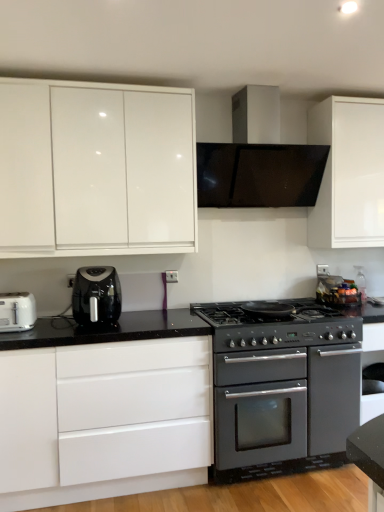
Question: Considering the positions of white glossy cabinet at lower left, positioned as the second cabinetry in top-to-bottom order, and glossy white cabinet at upper left, positioned as the 2th cabinetry in bottom-to-top order, in the image, is white glossy cabinet at lower left, positioned as the second cabinetry in top-to-bottom order, bigger or smaller than glossy white cabinet at upper left, positioned as the 2th cabinetry in bottom-to-top order,?

Choices:
 (A) small
 (B) big

Answer: (B)

Question: From a real-world perspective, relative to glossy white cabinet at upper left, positioned as the 2th cabinetry in bottom-to-top order, is white glossy cabinet at lower left, positioned as the second cabinetry in top-to-bottom order, vertically above or below?

Choices:
 (A) above
 (B) below

Answer: (B)

Question: Based on their relative distances, which object is farther from the matte black oven at center?

Choices:
 (A) glossy white cabinet at upper left, which is the first cabinetry in top-to-bottom order
 (B) white plastic toaster at left
 (C) black plastic air fryer at left
 (D) white glossy cabinet at lower left, positioned as the second cabinetry in top-to-bottom order
 (E) satin silver range hood at upper center

Answer: (B)

Question: Which of these objects is positioned closest to the matte black oven at center?

Choices:
 (A) glossy white cabinet at upper left, positioned as the 2th cabinetry in bottom-to-top order
 (B) white plastic toaster at left
 (C) black matte gas stove at center
 (D) satin silver range hood at upper center
 (E) white glossy cabinet at lower left, the 1th cabinetry from the bottom

Answer: (C)